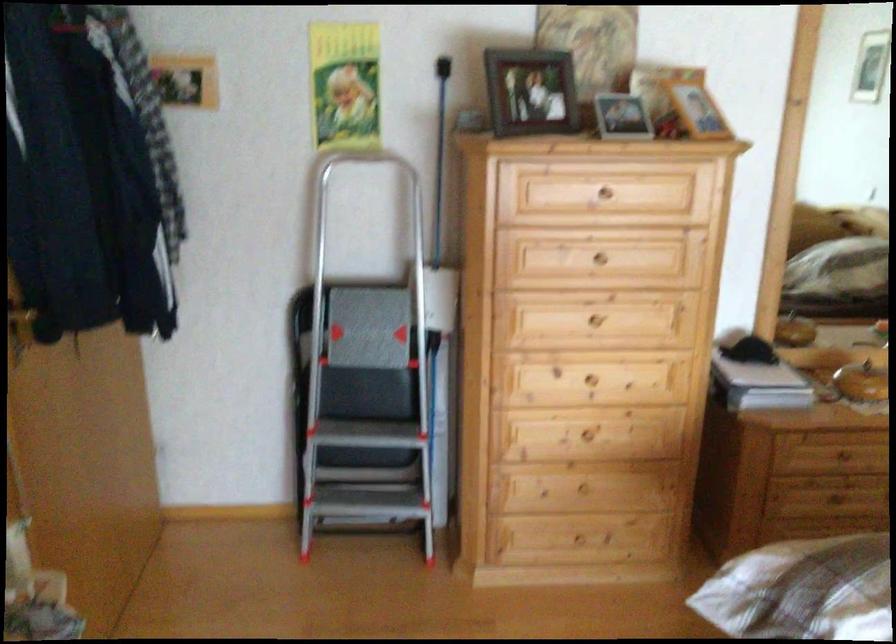
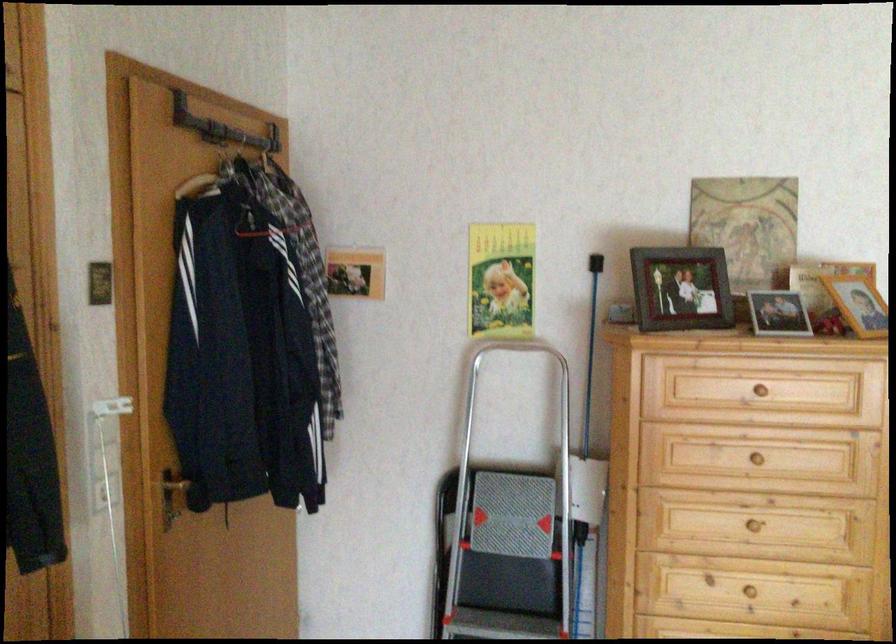
In the second image, find the point that corresponds to the point at 366,348 in the first image.

(510, 536)